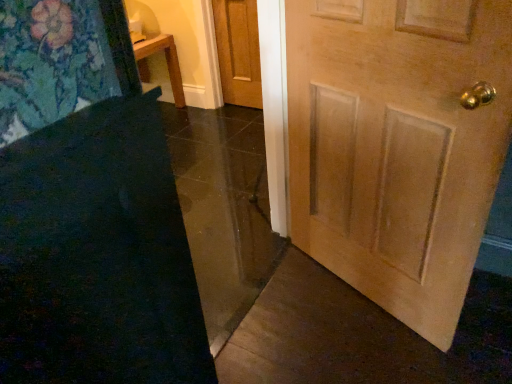
Question: Does light brown wood door at center, the 1th door from the back, have a lesser width compared to dark blue carpet at lower left?

Choices:
 (A) yes
 (B) no

Answer: (B)

Question: Is light brown wood door at center, the 1th door from the top, turned away from dark blue carpet at lower left?

Choices:
 (A) yes
 (B) no

Answer: (B)

Question: Is light brown wood door at center, the 1th door from the back, smaller than dark blue carpet at lower left?

Choices:
 (A) yes
 (B) no

Answer: (A)

Question: Considering the relative sizes of light brown wood door at center, the 1th door from the back, and dark blue carpet at lower left in the image provided, is light brown wood door at center, the 1th door from the back, taller than dark blue carpet at lower left?

Choices:
 (A) yes
 (B) no

Answer: (B)

Question: Considering the relative sizes of light brown wood door at center, the first door when ordered from left to right, and dark blue carpet at lower left in the image provided, is light brown wood door at center, the first door when ordered from left to right, shorter than dark blue carpet at lower left?

Choices:
 (A) no
 (B) yes

Answer: (B)

Question: From a real-world perspective, is light brown wood door at center, the 2th door in the bottom-to-top sequence, beneath dark blue carpet at lower left?

Choices:
 (A) yes
 (B) no

Answer: (A)

Question: From the image's perspective, is light brown wood door at center, which is the second door from right to left, under light brown wood door at center, the 2th door viewed from the back?

Choices:
 (A) no
 (B) yes

Answer: (A)

Question: Is light brown wood door at center, the second door positioned from the left, located within light brown wood door at center, the 2th door in the bottom-to-top sequence?

Choices:
 (A) no
 (B) yes

Answer: (A)

Question: Is light brown wood door at center, the 2th door in the bottom-to-top sequence, turned away from light brown wood door at center, which ranks as the 1th door in bottom-to-top order?

Choices:
 (A) no
 (B) yes

Answer: (A)

Question: From a real-world perspective, is light brown wood door at center, the 1th door from the top, on top of light brown wood door at center, marked as the second door in a top-to-bottom arrangement?

Choices:
 (A) no
 (B) yes

Answer: (A)

Question: Considering the relative sizes of light brown wood door at center, the 2th door in the bottom-to-top sequence, and light brown wood door at center, the second door positioned from the left, in the image provided, is light brown wood door at center, the 2th door in the bottom-to-top sequence, bigger than light brown wood door at center, the second door positioned from the left,?

Choices:
 (A) no
 (B) yes

Answer: (A)

Question: Are light brown wood door at center, the 1th door from the back, and light brown wood door at center, which ranks as the 1th door in front-to-back order, making contact?

Choices:
 (A) no
 (B) yes

Answer: (A)

Question: Considering the relative sizes of dark blue carpet at lower left and light brown wood door at center, marked as the first door in a right-to-left arrangement, in the image provided, is dark blue carpet at lower left taller than light brown wood door at center, marked as the first door in a right-to-left arrangement,?

Choices:
 (A) yes
 (B) no

Answer: (B)